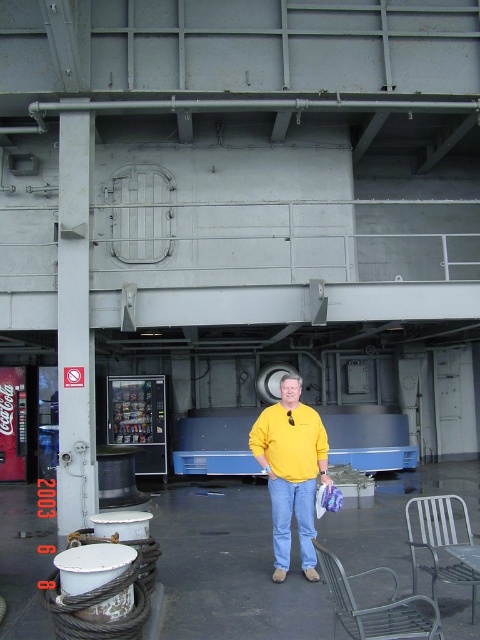
You are standing in the industrial naval structure shown in the scene. You need to locate the gray metallic pole at left. Where exactly is it positioned in terms of coordinates?

The gray metallic pole at left is positioned at coordinates point (74,323).

You are standing in the industrial naval structure and need to sit down. The metallic silver chair at lower right is at point 0.847, 0.917. Is the chair located closer to the vending machine or the circular hatch?

The metallic silver chair at lower right is located closer to the vending machine because its coordinates are at point [440,541], which places it near the lower right area where the vending machine is positioned.

You are standing in the industrial area and see the gray metallic pole at left and the blue denim jeans at center. Which object is positioned to the left of the other?

The gray metallic pole at left is positioned to the left of the blue denim jeans at center.